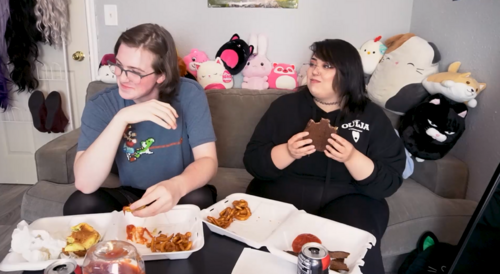
At what (x,y) coordinates should I click in order to perform the action: click on couch. Please return your answer as a coordinate pair (x, y). This screenshot has height=274, width=500. Looking at the image, I should click on (242, 117).